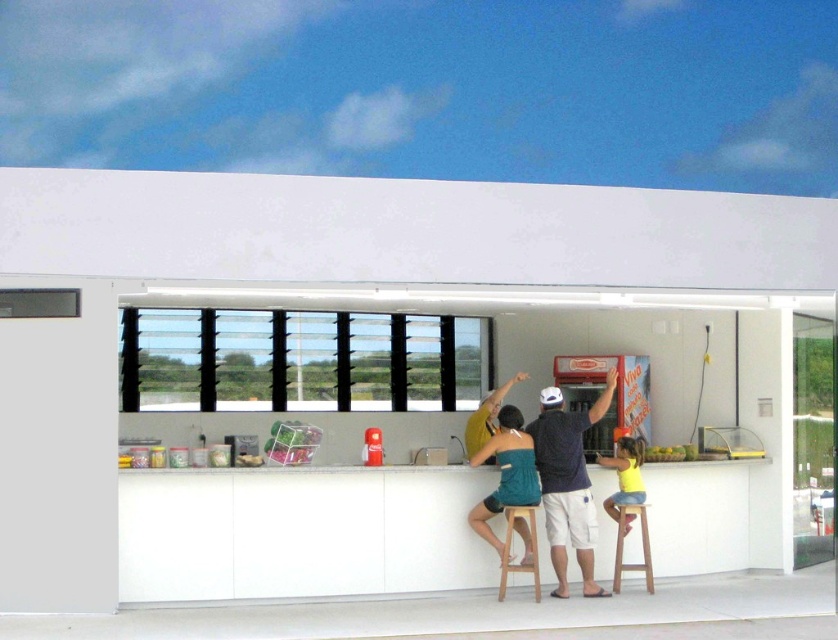
You are a customer at the food stall and want to place an order. You notice the teal fabric dress at center and the wooden stool at lower center near the counter. Which object takes up more space on the counter?

The teal fabric dress at center takes up more space on the counter because it is bigger than the wooden stool at lower center.

You are standing at the entrance of the food stall and want to reach the red fire extinguisher near the center of the counter. There is a person wearing a yellow cotton shirt at center blocking your path. Based on their position coordinates, can you estimate if you can walk around them to reach the fire extinguisher?

The yellow cotton shirt at center is located at point (624, 474), so yes, you can walk around them to reach the red fire extinguisher since their position allows for space to maneuver around.